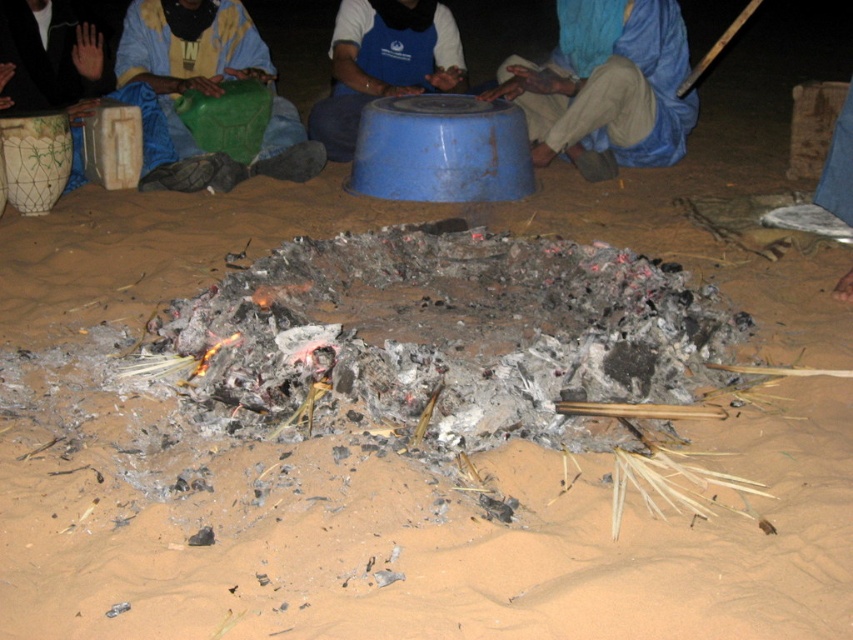
Can you confirm if blue fabric headscarf at upper center is shorter than green plastic container at left?

Yes, blue fabric headscarf at upper center is shorter than green plastic container at left.

Which is behind, point (677, 20) or point (131, 60)?

Point (677, 20)

Where is `blue fabric headscarf at upper center`? blue fabric headscarf at upper center is located at coordinates (607, 83).

Does green plastic container at left have a lesser height compared to blue plastic bowl at center?

No.

Which is in front, point (292, 177) or point (351, 12)?

Point (292, 177) is in front.

Where is `green plastic container at left`? The image size is (853, 640). green plastic container at left is located at coordinates (209, 88).

Who is positioned more to the right, blue fabric headscarf at upper center or blue plastic bowl at center?

From the viewer's perspective, blue fabric headscarf at upper center appears more on the right side.

Is the position of blue fabric headscarf at upper center less distant than that of blue plastic bowl at center?

That is True.

Between point (682, 38) and point (358, 102), which one is positioned in front?

Point (358, 102) is in front.

At what (x,y) coordinates should I click in order to perform the action: click on blue fabric headscarf at upper center. Please return your answer as a coordinate pair (x, y). Looking at the image, I should click on (607, 83).